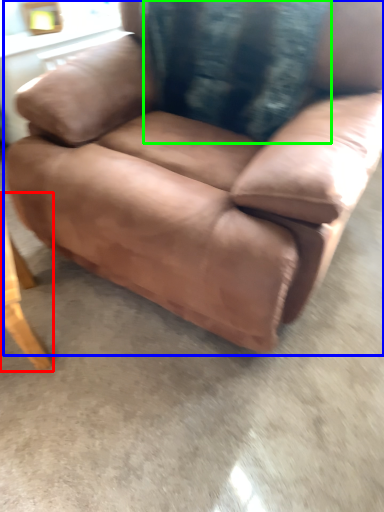
Question: Estimate the real-world distances between objects in this image. Which object is closer to table (highlighted by a red box), chair (highlighted by a blue box) or pillow (highlighted by a green box)?

Choices:
 (A) chair
 (B) pillow

Answer: (A)